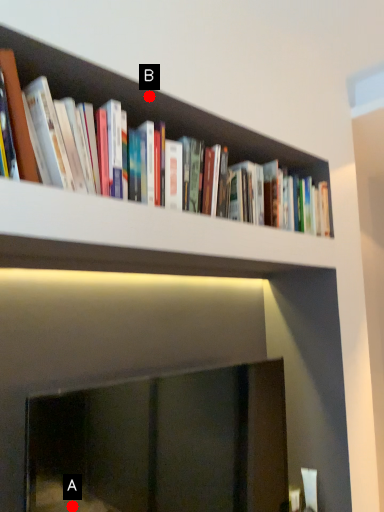
Question: Two points are circled on the image, labeled by A and B beside each circle. Among these points, which one is farthest from the camera?

Choices:
 (A) A is further
 (B) B is further

Answer: (B)